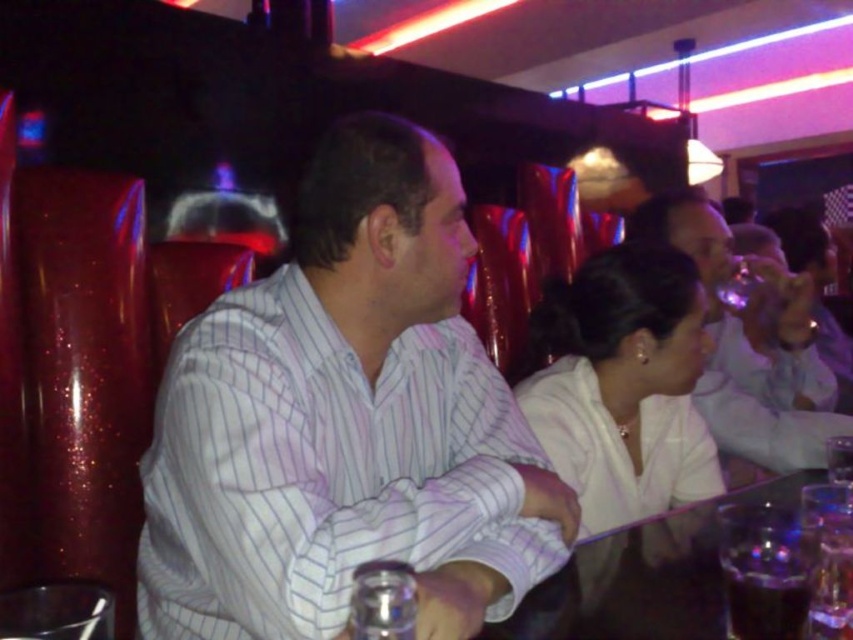
You are a photographer at the event and want to capture the white satin blouse at center and dark liquid glass at lower right in the same frame. Which object should you position closer to the left side of the camera frame?

The white satin blouse at center should be positioned closer to the left side of the camera frame because it is located to the left of the dark liquid glass at lower right.

You are a server in this bar, and you need to deliver a drink to the table. The drink must be placed on the translucent glass table at center. However, there is a dark liquid glass at lower right nearby. How far apart are these two items?

The translucent glass table at center is 11.67 centimeters from the dark liquid glass at lower right.

You are a server at the bar and need to place a drink on the translucent glass table at center. Considering your height and the table height, will you need to bend down to place the drink?

The translucent glass table at center is 26.39 inches from viewer. The average table height is around 29 inches. Since the table is slightly lower than average, you may need to bend down slightly to place the drink.